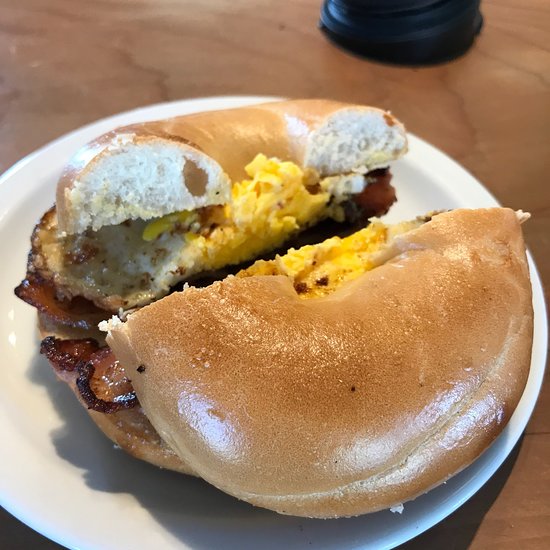
Where is `black cup`? black cup is located at coordinates (420, 26).